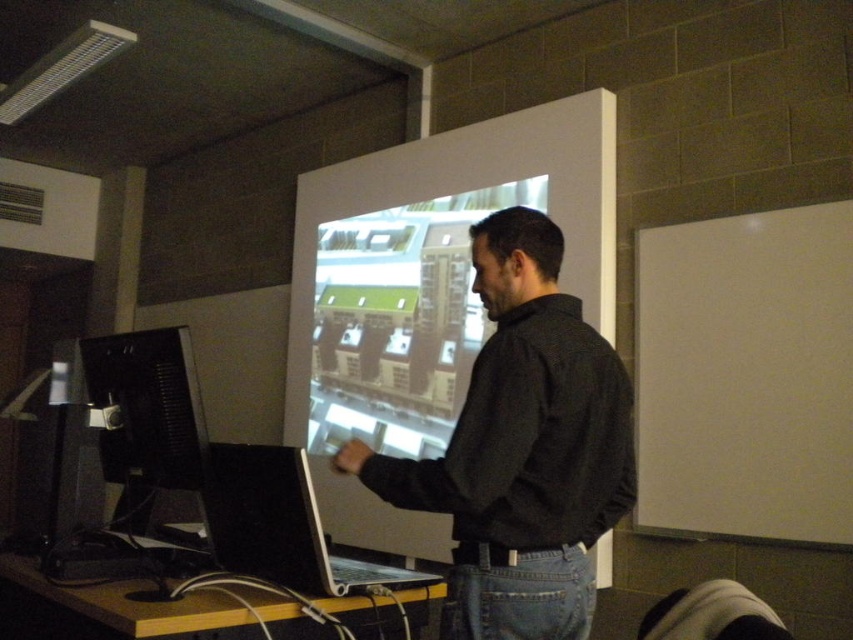
Does black matte shirt at center have a smaller size compared to matte glass projection screen at center?

Yes.

Is black matte shirt at center wider than matte glass projection screen at center?

In fact, black matte shirt at center might be narrower than matte glass projection screen at center.

Is point (548, 422) less distant than point (350, 280)?

Yes, it is in front of point (350, 280).

What are the coordinates of `black matte shirt at center` in the screenshot? It's located at (521, 449).

Is white matte projection screen at right positioned in front of silver metallic laptop at center?

No, white matte projection screen at right is further to the viewer.

Who is more forward, (782, 296) or (349, 573)?

Point (349, 573) is in front.

Where is `white matte projection screen at right`? Image resolution: width=853 pixels, height=640 pixels. white matte projection screen at right is located at coordinates (746, 376).

Can you confirm if matte glass projection screen at center is thinner than silver metallic laptop at center?

No.

In the scene shown: Is matte glass projection screen at center to the left of silver metallic laptop at center from the viewer's perspective?

In fact, matte glass projection screen at center is to the right of silver metallic laptop at center.

At what (x,y) coordinates should I click in order to perform the action: click on matte glass projection screen at center. Please return your answer as a coordinate pair (x, y). This screenshot has width=853, height=640. Looking at the image, I should click on (399, 321).